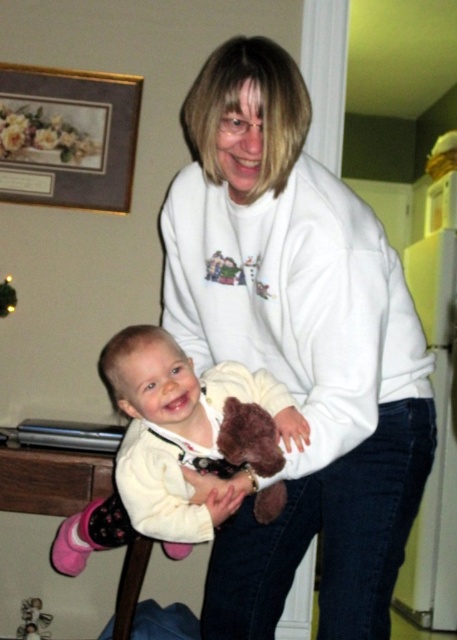
Which of these two, white fleece sweatshirt at center or gold-framed floral print at upper left, stands shorter?

gold-framed floral print at upper left

Between white fleece sweatshirt at center and gold-framed floral print at upper left, which one has more height?

Standing taller between the two is white fleece sweatshirt at center.

Between point (196, 289) and point (110, 189), which one is positioned behind?

The point (110, 189) is behind.

The height and width of the screenshot is (640, 457). Identify the location of white fleece sweatshirt at center. (297, 346).

Is white soft teddy bear at lower left further to the viewer compared to soft plush teddy bear at center?

No.

Is white soft teddy bear at lower left closer to the viewer compared to soft plush teddy bear at center?

Yes, white soft teddy bear at lower left is in front of soft plush teddy bear at center.

Identify the location of white soft teddy bear at lower left. The width and height of the screenshot is (457, 640). (175, 442).

You are a GUI agent. You are given a task and a screenshot of the screen. Output one action in this format:
    pyautogui.click(x=<x>, y=<y>)
    Task: Click on the white soft teddy bear at lower left
    Image resolution: width=457 pixels, height=640 pixels.
    Given the screenshot: What is the action you would take?
    [x=175, y=442]

Between gold-framed floral print at upper left and soft plush teddy bear at center, which one appears on the left side from the viewer's perspective?

From the viewer's perspective, soft plush teddy bear at center appears more on the left side.

Does point (64, 198) come farther from viewer compared to point (21, 621)?

Yes.

The height and width of the screenshot is (640, 457). What are the coordinates of `gold-framed floral print at upper left` in the screenshot? It's located at (68, 136).